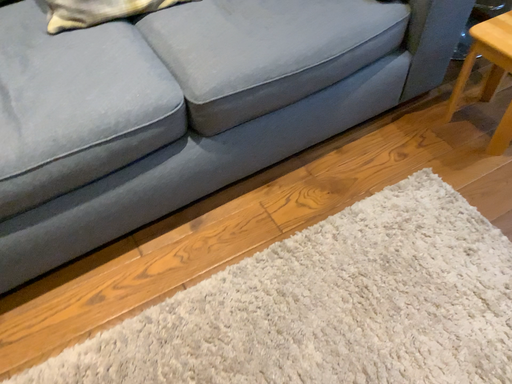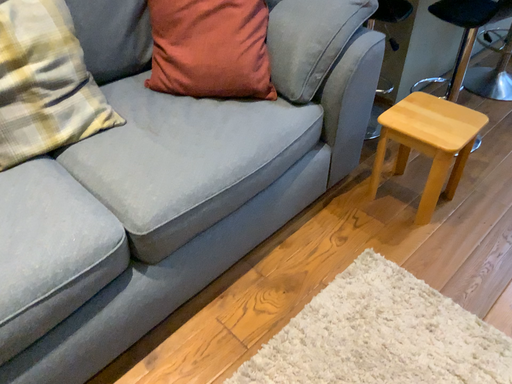
Question: How did the camera likely rotate when shooting the video?

Choices:
 (A) rotated upward
 (B) rotated downward

Answer: (A)